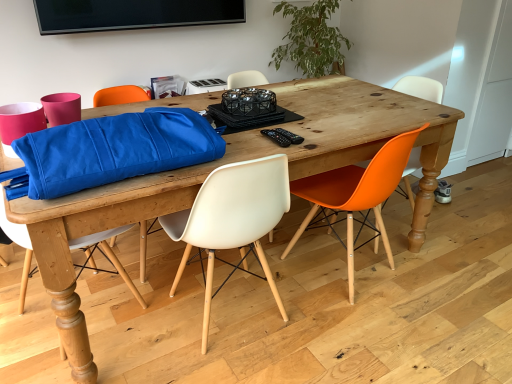
Question: Is green leafy plant at upper center completely or partially outside of black plastic remote control at center, which is the 2th remote control in right-to-left order?

Choices:
 (A) yes
 (B) no

Answer: (A)

Question: Can you confirm if green leafy plant at upper center is thinner than black plastic remote control at center, which is the 2th remote control in right-to-left order?

Choices:
 (A) yes
 (B) no

Answer: (B)

Question: Does green leafy plant at upper center have a greater width compared to black plastic remote control at center, which is the 2th remote control in right-to-left order?

Choices:
 (A) yes
 (B) no

Answer: (A)

Question: Can you confirm if green leafy plant at upper center is positioned to the right of black plastic remote control at center, which is the 2th remote control in right-to-left order?

Choices:
 (A) yes
 (B) no

Answer: (A)

Question: Is black plastic remote control at center, the 1th remote control in the left-to-right sequence, surrounded by green leafy plant at upper center?

Choices:
 (A) yes
 (B) no

Answer: (B)

Question: Is point (399, 91) positioned closer to the camera than point (274, 134)?

Choices:
 (A) farther
 (B) closer

Answer: (A)

Question: From the image's perspective, is orange matte plastic chair at right, which is the 1th chair from right to left, located above or below black plastic remote control at center, which is the 2th remote control in right-to-left order?

Choices:
 (A) below
 (B) above

Answer: (A)

Question: Is orange matte plastic chair at right, marked as the fourth chair in a left-to-right arrangement, in front of or behind black plastic remote control at center, which is the 2th remote control in right-to-left order, in the image?

Choices:
 (A) front
 (B) behind

Answer: (B)

Question: Is orange matte plastic chair at right, which is the 1th chair from right to left, spatially inside black plastic remote control at center, which is the 2th remote control in right-to-left order, or outside of it?

Choices:
 (A) inside
 (B) outside

Answer: (B)

Question: From the image's perspective, is orange matte plastic chair at right, which is the 1th chair from right to left, above or below white plastic chair at center, marked as the 2th chair in a left-to-right arrangement?

Choices:
 (A) above
 (B) below

Answer: (A)

Question: Looking at the image, does orange matte plastic chair at right, which is the 1th chair from right to left, seem bigger or smaller compared to white plastic chair at center, marked as the 2th chair in a left-to-right arrangement?

Choices:
 (A) small
 (B) big

Answer: (A)

Question: In terms of height, does orange matte plastic chair at right, which is the 1th chair from right to left, look taller or shorter compared to white plastic chair at center, marked as the 2th chair in a left-to-right arrangement?

Choices:
 (A) tall
 (B) short

Answer: (A)

Question: Is point (407, 92) closer or farther from the camera than point (251, 206)?

Choices:
 (A) closer
 (B) farther

Answer: (B)

Question: Is black plastic remote control at center, acting as the second remote control starting from the left, bigger or smaller than green leafy plant at upper center?

Choices:
 (A) small
 (B) big

Answer: (A)

Question: Relative to green leafy plant at upper center, is black plastic remote control at center, acting as the second remote control starting from the left, in front or behind?

Choices:
 (A) front
 (B) behind

Answer: (A)